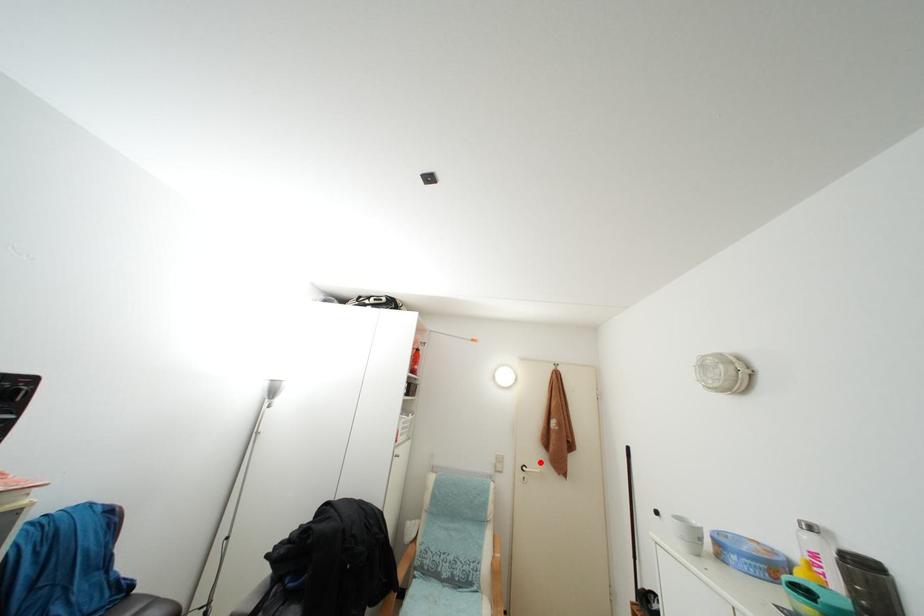
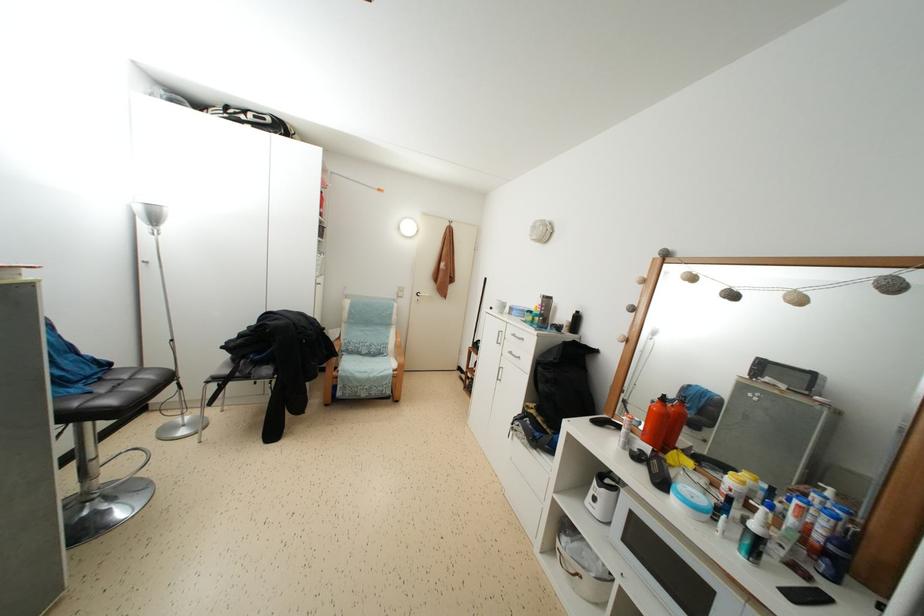
Where in the second image is the point corresponding to the highlighted location from the first image?

(432, 293)